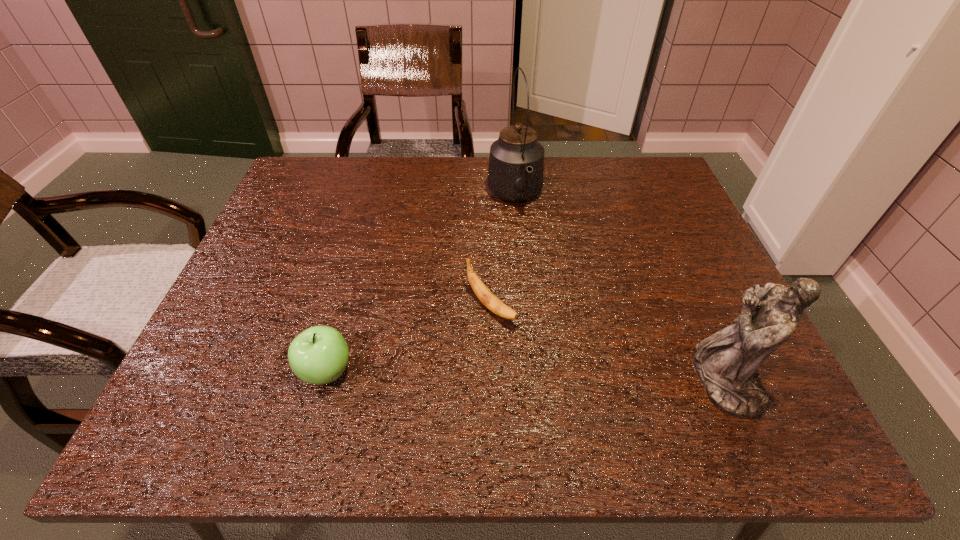
Find the location of a particular element. This screenshot has width=960, height=540. figurine positioned at the near edge is located at coordinates (726, 363).

Locate an element on the screen. The image size is (960, 540). object at the right edge is located at coordinates (726, 363).

Identify the location of object positioned at the near right corner. (x=726, y=363).

This screenshot has height=540, width=960. Find the location of `vacant area at the far edge of the desktop`. vacant area at the far edge of the desktop is located at coordinates (x=596, y=169).

Where is `vacant space at the near edge of the desktop`? This screenshot has height=540, width=960. vacant space at the near edge of the desktop is located at coordinates (524, 384).

You are a GUI agent. You are given a task and a screenshot of the screen. Output one action in this format:
    pyautogui.click(x=<x>, y=<y>)
    Task: Click on the vacant area at the left edge of the desktop
    This screenshot has height=540, width=960.
    Given the screenshot: What is the action you would take?
    pyautogui.click(x=223, y=339)

Identify the location of free location at the right edge of the desktop. The width and height of the screenshot is (960, 540). (666, 294).

Find the location of a particular element. Image resolution: width=960 pixels, height=540 pixels. vacant space at the far left corner of the desktop is located at coordinates (329, 183).

In the image, there is a desktop. Identify the location of vacant space at the near left corner. (261, 380).

At what (x,y) coordinates should I click in order to perform the action: click on free space at the far right corner. Please return your answer as a coordinate pair (x, y). The height and width of the screenshot is (540, 960). Looking at the image, I should click on (644, 167).